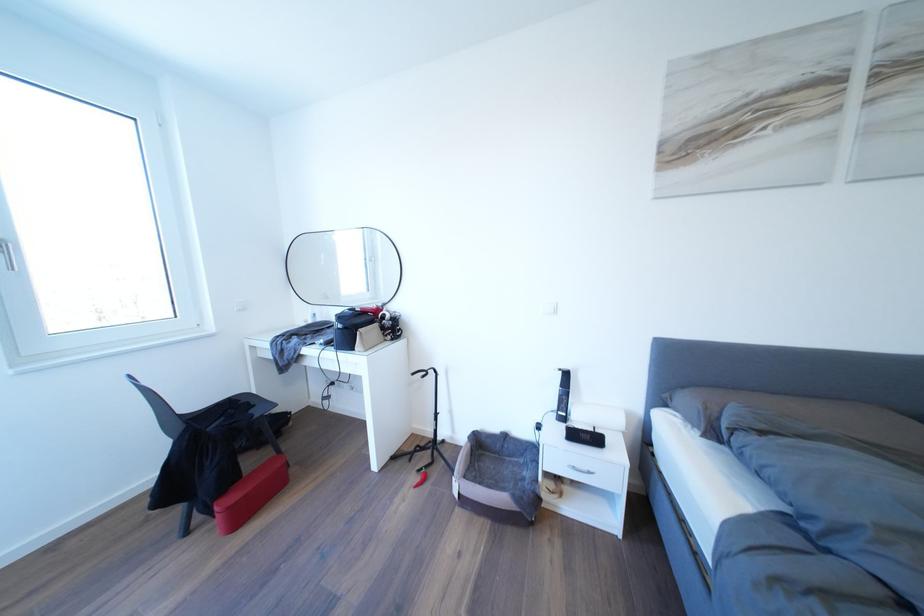
What do you see at coordinates (580, 469) in the screenshot? I see `a white drawer handle` at bounding box center [580, 469].